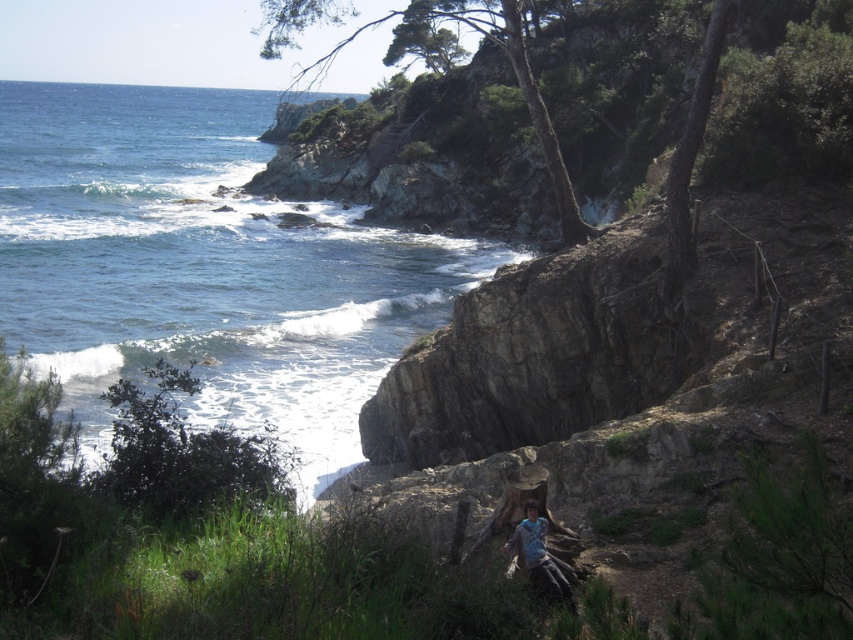
Does point (265, 256) lie in front of point (538, 557)?

That is False.

Based on the photo, is blue water at lower left wider than blue denim jeans at lower center?

Yes.

Where is `blue water at lower left`? blue water at lower left is located at coordinates (202, 268).

I want to click on blue water at lower left, so click(x=202, y=268).